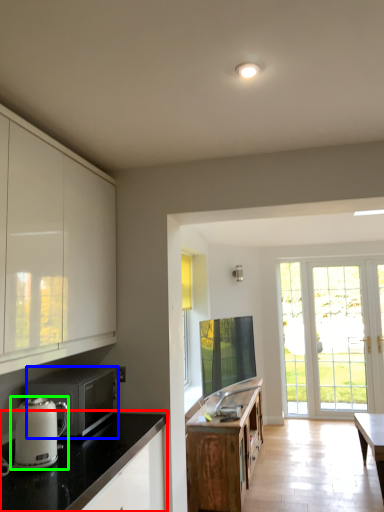
Question: Which object is the closest to the countertop (highlighted by a red box)? Choose among these: microwave oven (highlighted by a blue box) or kitchen appliance (highlighted by a green box).

Choices:
 (A) microwave oven
 (B) kitchen appliance

Answer: (B)